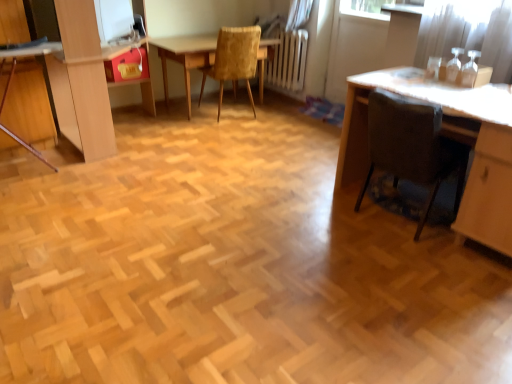
Describe the element at coordinates (362, 46) in the screenshot. I see `transparent glass screen door at upper right` at that location.

The width and height of the screenshot is (512, 384). In order to click on transparent glass screen door at upper right in this screenshot , I will do `click(362, 46)`.

Measure the distance between point (125, 58) and camera.

11.27 feet.

Find the location of a particular element. matte red drawer at upper left is located at coordinates (127, 66).

Identify the location of velvet yellow chair at center, placed as the 1th chair when sorted from top to bottom. (234, 60).

You are a GUI agent. You are given a task and a screenshot of the screen. Output one action in this format:
    pyautogui.click(x=<x>, y=<y>)
    Task: Click on the transparent glass screen door at upper right
    Image resolution: width=512 pixels, height=384 pixels.
    Given the screenshot: What is the action you would take?
    pyautogui.click(x=362, y=46)

Looking at their sizes, would you say velvet yellow chair at center, the 2th chair viewed from the right, is wider or thinner than transparent glass screen door at upper right?

Clearly, velvet yellow chair at center, the 2th chair viewed from the right, has more width compared to transparent glass screen door at upper right.

From the image's perspective, which is above, velvet yellow chair at center, which ranks as the second chair in bottom-to-top order, or transparent glass screen door at upper right?

transparent glass screen door at upper right is shown above in the image.

Could you measure the distance between velvet yellow chair at center, which is the second chair in front-to-back order, and transparent glass screen door at upper right?

velvet yellow chair at center, which is the second chair in front-to-back order, is 3.31 feet from transparent glass screen door at upper right.

In the image, is velvet yellow chair at center, marked as the 1th chair in a back-to-front arrangement, positioned in front of or behind transparent glass screen door at upper right?

Visually, velvet yellow chair at center, marked as the 1th chair in a back-to-front arrangement, is located behind transparent glass screen door at upper right.

From the image's perspective, which one is positioned higher, matte wooden dresser at left or matte red drawer at upper left?

From the image's view, matte red drawer at upper left is above.

Is matte wooden dresser at left at the left side of matte red drawer at upper left?

Correct, you'll find matte wooden dresser at left to the left of matte red drawer at upper left.

Between matte wooden dresser at left and matte red drawer at upper left, which one has less height?

matte red drawer at upper left.

Is matte red drawer at upper left at the back of matte wooden dresser at left?

Yes, matte red drawer at upper left is at the back of matte wooden dresser at left.

From a real-world perspective, who is located higher, transparent glass screen door at upper right or brown fabric chair at lower right, which is the 2th chair from back to front?

From a 3D spatial view, transparent glass screen door at upper right is above.

This screenshot has width=512, height=384. Find the location of `chair in front of the transparent glass screen door at upper right`. chair in front of the transparent glass screen door at upper right is located at coordinates (412, 147).

Consider the image. How many degrees apart are the facing directions of transparent glass screen door at upper right and brown fabric chair at lower right, which ranks as the 1th chair in front-to-back order?

The facing directions of transparent glass screen door at upper right and brown fabric chair at lower right, which ranks as the 1th chair in front-to-back order, are 180 degrees apart.

Who is shorter, transparent glass screen door at upper right or brown fabric chair at lower right, the second chair viewed from the left?

Standing shorter between the two is brown fabric chair at lower right, the second chair viewed from the left.

From the picture: From the image's perspective, is transparent glass screen door at upper right located beneath matte wooden dresser at left?

No, from the image's perspective, transparent glass screen door at upper right is not beneath matte wooden dresser at left.

Is transparent glass screen door at upper right located outside matte wooden dresser at left?

transparent glass screen door at upper right is positioned outside matte wooden dresser at left.

Which of these two, transparent glass screen door at upper right or matte wooden dresser at left, stands shorter?

transparent glass screen door at upper right is shorter.

Looking at the image, does matte wooden dresser at left seem bigger or smaller compared to wooden table at center?

Clearly, matte wooden dresser at left is larger in size than wooden table at center.

Is matte wooden dresser at left with wooden table at center?

No, matte wooden dresser at left is not making contact with wooden table at center.

Considering the relative positions of brown fabric chair at lower right, which ranks as the 1th chair in front-to-back order, and wooden table at center in the image provided, is brown fabric chair at lower right, which ranks as the 1th chair in front-to-back order, to the left of wooden table at center from the viewer's perspective?

In fact, brown fabric chair at lower right, which ranks as the 1th chair in front-to-back order, is to the right of wooden table at center.

From the image's perspective, is brown fabric chair at lower right, which ranks as the 1th chair in front-to-back order, on top of wooden table at center?

No.

Between brown fabric chair at lower right, acting as the first chair starting from the right, and wooden table at center, which one has more height?

With more height is brown fabric chair at lower right, acting as the first chair starting from the right.

Is matte wooden dresser at left far from transparent glass screen door at upper right?

Yes, matte wooden dresser at left is far from transparent glass screen door at upper right.

From a real-world perspective, which object stands above the other?

From a 3D spatial view, matte wooden dresser at left is above.

Measure the distance between matte wooden dresser at left and transparent glass screen door at upper right.

They are 7.56 feet apart.

Would you say transparent glass screen door at upper right is part of matte wooden dresser at left's contents?

Actually, transparent glass screen door at upper right is outside matte wooden dresser at left.

In order to click on the 2nd chair counting from the left of the transparent glass screen door at upper right in this screenshot , I will do `click(234, 60)`.

This screenshot has width=512, height=384. I want to click on drawer that is behind the matte wooden dresser at left, so coord(127,66).

Looking at the image, which one is located further to brown fabric chair at lower right, acting as the first chair starting from the right, matte red drawer at upper left or wooden table at center?

The object further to brown fabric chair at lower right, acting as the first chair starting from the right, is matte red drawer at upper left.

When comparing their distances from velvet yellow chair at center, placed as the 1th chair when sorted from top to bottom, does matte wooden dresser at left or wooden table at center seem closer?

wooden table at center is positioned closer to the anchor velvet yellow chair at center, placed as the 1th chair when sorted from top to bottom.

When comparing their distances from velvet yellow chair at center, the 2th chair viewed from the right, does wooden table at center or transparent glass screen door at upper right seem closer?

wooden table at center.

Looking at the image, which one is located further to wooden table at center, brown fabric chair at lower right, which ranks as the 1th chair in front-to-back order, or matte red drawer at upper left?

brown fabric chair at lower right, which ranks as the 1th chair in front-to-back order, is further to wooden table at center.

In the scene shown: Considering their positions, is velvet yellow chair at center, which appears as the first chair when viewed from the left, positioned closer to transparent glass screen door at upper right than wooden table at center?

Based on the image, velvet yellow chair at center, which appears as the first chair when viewed from the left, appears to be nearer to transparent glass screen door at upper right.

Considering their positions, is wooden table at center positioned further to matte wooden dresser at left than velvet yellow chair at center, which is the second chair in front-to-back order?

Among the two, velvet yellow chair at center, which is the second chair in front-to-back order, is located further to matte wooden dresser at left.

From the image, which object appears to be farther from transparent glass screen door at upper right, matte red drawer at upper left or matte wooden dresser at left?

Among the two, matte wooden dresser at left is located further to transparent glass screen door at upper right.

Estimate the real-world distances between objects in this image. Which object is further from matte wooden dresser at left, transparent glass screen door at upper right or brown fabric chair at lower right, the second chair in the top-to-bottom sequence?

transparent glass screen door at upper right is further to matte wooden dresser at left.

Image resolution: width=512 pixels, height=384 pixels. Find the location of `table between matte red drawer at upper left and brown fabric chair at lower right, acting as the first chair starting from the bottom`. table between matte red drawer at upper left and brown fabric chair at lower right, acting as the first chair starting from the bottom is located at coordinates (186, 56).

You are a GUI agent. You are given a task and a screenshot of the screen. Output one action in this format:
    pyautogui.click(x=<x>, y=<y>)
    Task: Click on the table between matte red drawer at upper left and transparent glass screen door at upper right in the horizontal direction
    
    Given the screenshot: What is the action you would take?
    pyautogui.click(x=186, y=56)

Locate an element on the screen. chair positioned between brown fabric chair at lower right, the second chair in the top-to-bottom sequence, and wooden table at center from near to far is located at coordinates (234, 60).

Where is `screen door between brown fabric chair at lower right, acting as the first chair starting from the right, and velvet yellow chair at center, the 2th chair viewed from the right, in the front-back direction`? The height and width of the screenshot is (384, 512). screen door between brown fabric chair at lower right, acting as the first chair starting from the right, and velvet yellow chair at center, the 2th chair viewed from the right, in the front-back direction is located at coordinates (362, 46).